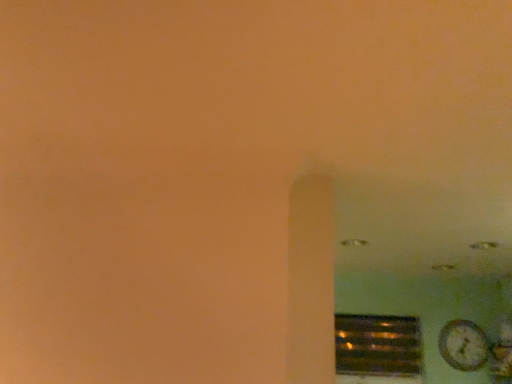
Question: From their relative heights in the image, would you say wooden textured clock at lower right is taller or shorter than metallic reflective vent at lower right?

Choices:
 (A) tall
 (B) short

Answer: (B)

Question: From the image's perspective, relative to metallic reflective vent at lower right, is wooden textured clock at lower right above or below?

Choices:
 (A) above
 (B) below

Answer: (A)

Question: In terms of size, does wooden textured clock at lower right appear bigger or smaller than metallic reflective vent at lower right?

Choices:
 (A) small
 (B) big

Answer: (A)

Question: Considering the positions of point (362, 344) and point (451, 347), is point (362, 344) closer or farther from the camera than point (451, 347)?

Choices:
 (A) farther
 (B) closer

Answer: (A)

Question: Looking at their shapes, would you say metallic reflective vent at lower right is wider or thinner than wooden textured clock at lower right?

Choices:
 (A) thin
 (B) wide

Answer: (B)

Question: Considering the positions of metallic reflective vent at lower right and wooden textured clock at lower right in the image, is metallic reflective vent at lower right taller or shorter than wooden textured clock at lower right?

Choices:
 (A) short
 (B) tall

Answer: (B)

Question: Is metallic reflective vent at lower right situated inside wooden textured clock at lower right or outside?

Choices:
 (A) inside
 (B) outside

Answer: (B)